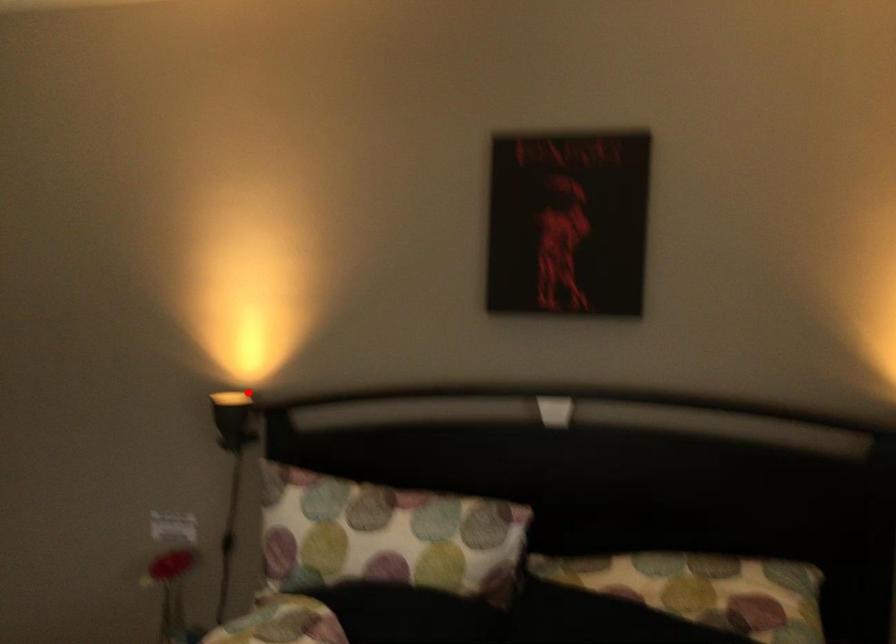
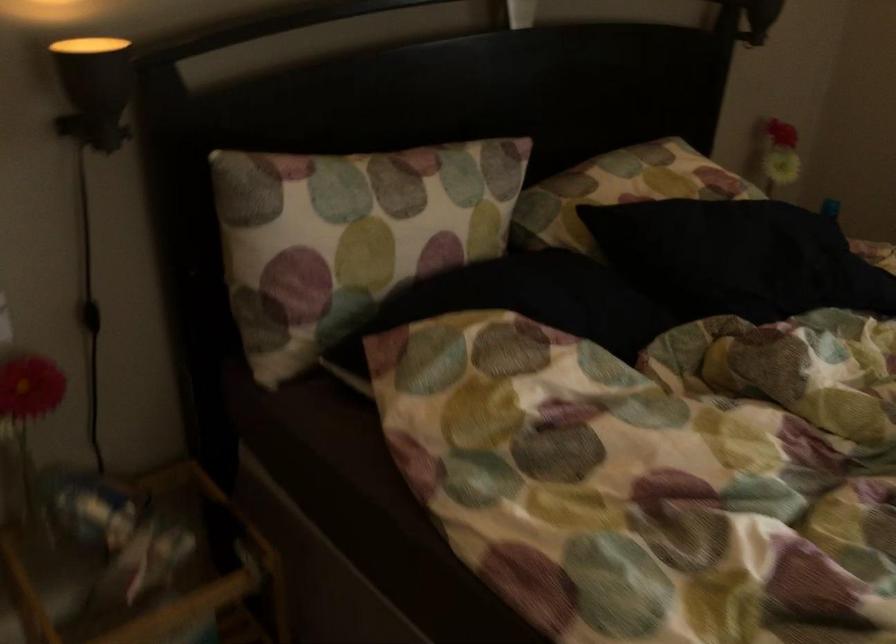
The point at the highlighted location is marked in the first image. Where is the corresponding point in the second image?

(90, 48)